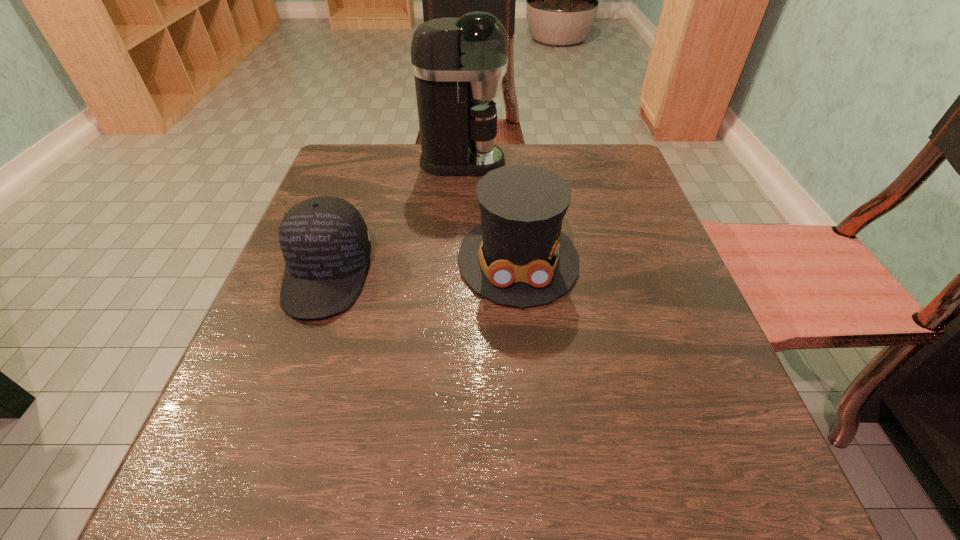
Image resolution: width=960 pixels, height=540 pixels. What are the coordinates of `the tallest object` in the screenshot? It's located at (458, 64).

Locate an element on the screen. The image size is (960, 540). coffee maker is located at coordinates (458, 64).

This screenshot has height=540, width=960. In order to click on the second shortest object in this screenshot , I will do `click(518, 256)`.

Locate an element on the screen. This screenshot has height=540, width=960. the shortest object is located at coordinates (324, 240).

The height and width of the screenshot is (540, 960). What are the coordinates of `baseball cap` in the screenshot? It's located at (324, 240).

I want to click on free point located place cup under the spout of the coffee maker, so click(x=582, y=162).

Locate an element on the screen. Image resolution: width=960 pixels, height=540 pixels. free location located 0.070m with goggles on the front of the dress hat is located at coordinates (526, 343).

What are the coordinates of `vacant space located at the front of the shortest object where the brim is located` in the screenshot? It's located at (267, 448).

Where is `object at the far edge`? The width and height of the screenshot is (960, 540). object at the far edge is located at coordinates (x=458, y=64).

I want to click on object located at the left edge, so click(324, 240).